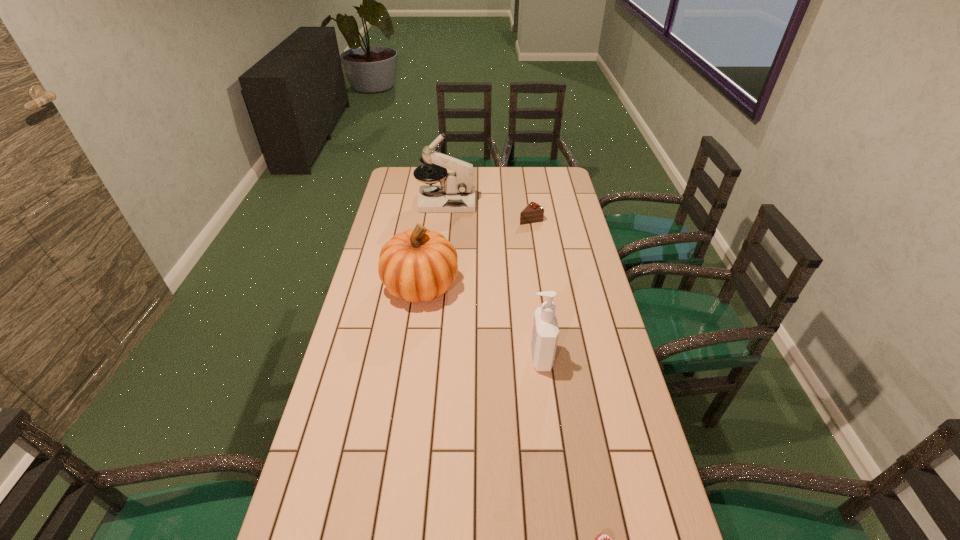
The height and width of the screenshot is (540, 960). I want to click on free region located 0.220m on the front of the farther chocolate cake, so click(537, 258).

The height and width of the screenshot is (540, 960). Find the location of `object present at the far edge`. object present at the far edge is located at coordinates (456, 193).

Find the location of a particular element. The image size is (960, 540). microscope present at the left edge is located at coordinates (456, 193).

The width and height of the screenshot is (960, 540). Find the location of `pumpkin that is positioned at the left edge`. pumpkin that is positioned at the left edge is located at coordinates (418, 265).

Identify the location of object that is at the right edge. Image resolution: width=960 pixels, height=540 pixels. (533, 212).

The image size is (960, 540). In order to click on object present at the far left corner in this screenshot , I will do `click(456, 193)`.

The image size is (960, 540). In the image, there is a desktop. Identify the location of vacant space at the far edge. (510, 183).

Image resolution: width=960 pixels, height=540 pixels. Identify the location of vacant space at the left edge of the desktop. (373, 398).

In the image, there is a desktop. Identify the location of free region at the right edge. (574, 231).

This screenshot has width=960, height=540. What are the coordinates of `vacant point at the far left corner` in the screenshot? It's located at (389, 186).